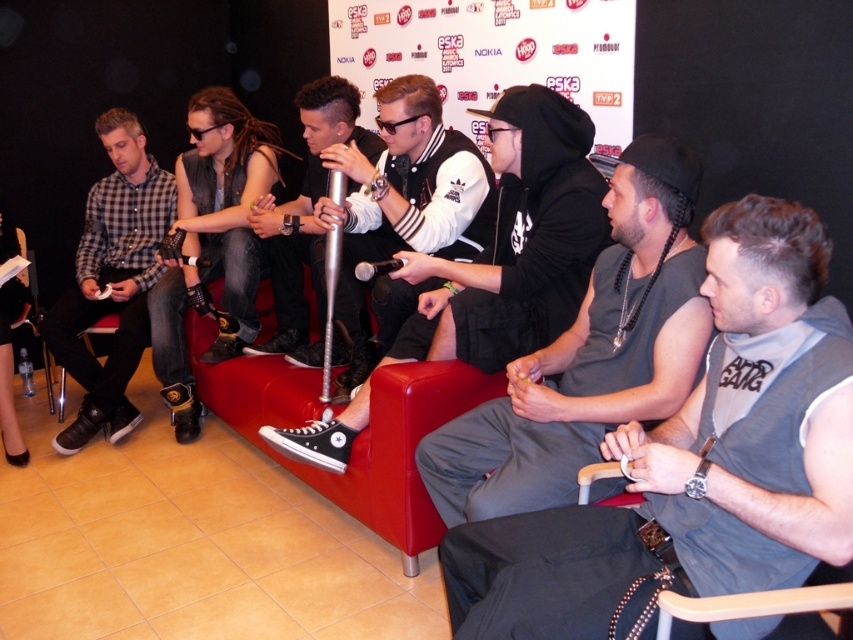
Looking at this image, does black canvas shoe at center appear over white leather jacket at center?

No, black canvas shoe at center is not above white leather jacket at center.

Which is below, black canvas shoe at center or white leather jacket at center?

Positioned lower is black canvas shoe at center.

Between point (544, 237) and point (471, 180), which one is positioned behind?

The point (471, 180) is more distant.

I want to click on black canvas shoe at center, so click(515, 243).

Between point (714, 570) and point (329, 81), which one is positioned behind?

The point (329, 81) is more distant.

Where is `gray fabric vest at center`? This screenshot has height=640, width=853. gray fabric vest at center is located at coordinates (695, 461).

I want to click on gray fabric vest at center, so click(695, 461).

Does gray fabric vest at center appear under wooden at lower right?

No, gray fabric vest at center is not below wooden at lower right.

Between gray fabric vest at center and wooden at lower right, which one has more height?

gray fabric vest at center is taller.

Between point (635, 532) and point (666, 602), which one is positioned in front?

Point (666, 602) is more forward.

Where is `gray fabric vest at center`? gray fabric vest at center is located at coordinates (695, 461).